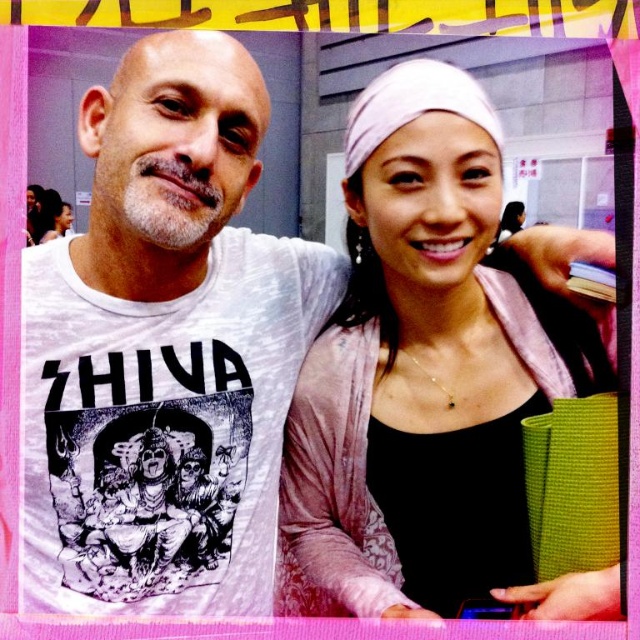
Question: Is white cotton t-shirt at left thinner than pink fabric headband at upper right?

Choices:
 (A) no
 (B) yes

Answer: (B)

Question: Which of the following is the closest to the observer?

Choices:
 (A) pink fabric headband at upper right
 (B) white cotton t-shirt at left

Answer: (A)

Question: Is white cotton t-shirt at left behind pink fabric headband at upper right?

Choices:
 (A) no
 (B) yes

Answer: (B)

Question: Where is white cotton t-shirt at left located in relation to pink fabric headband at upper right in the image?

Choices:
 (A) above
 (B) below

Answer: (A)